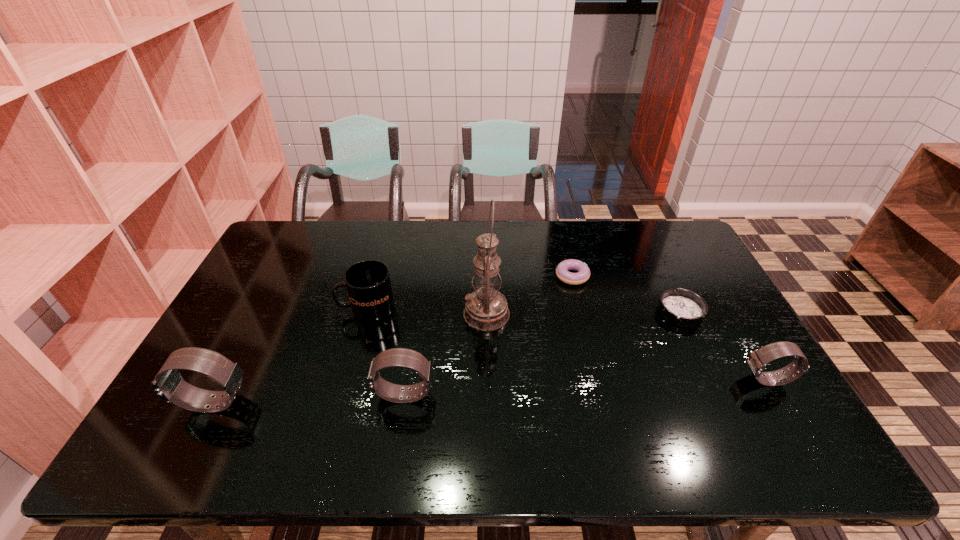
Locate an element on the screen. Image resolution: width=960 pixels, height=540 pixels. free spot located on the face of the second tallest watch is located at coordinates (350, 395).

You are a GUI agent. You are given a task and a screenshot of the screen. Output one action in this format:
    pyautogui.click(x=<x>, y=<y>)
    Task: Click on the blank space located on the face of the second tallest watch
    Image resolution: width=960 pixels, height=540 pixels.
    Given the screenshot: What is the action you would take?
    pyautogui.click(x=223, y=395)

Image resolution: width=960 pixels, height=540 pixels. I want to click on blank space located on the face of the second tallest watch, so click(346, 395).

Identify the location of vacant region located on the face of the rightmost watch. This screenshot has height=540, width=960. (608, 380).

This screenshot has width=960, height=540. In order to click on free space located on the face of the rightmost watch in this screenshot , I will do `click(701, 380)`.

Identify the location of free spot located 0.070m on the face of the rightmost watch. (716, 380).

Locate an element on the screen. This screenshot has width=960, height=540. vacant point located on the front of the farthest object is located at coordinates (579, 305).

Image resolution: width=960 pixels, height=540 pixels. Identify the location of free space located 0.340m on the back of the tallest object. (486, 234).

At what (x,y) coordinates should I click in order to perform the action: click on vacant space located 0.230m with the handle on the side of the mug. Please return your answer as a coordinate pair (x, y). Looking at the image, I should click on (264, 308).

Locate an element on the screen. The image size is (960, 540). vacant space located 0.180m with the handle on the side of the mug is located at coordinates (280, 308).